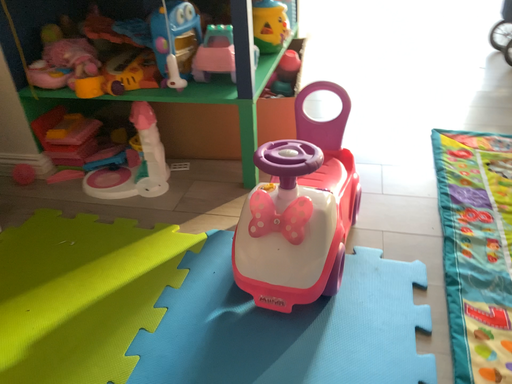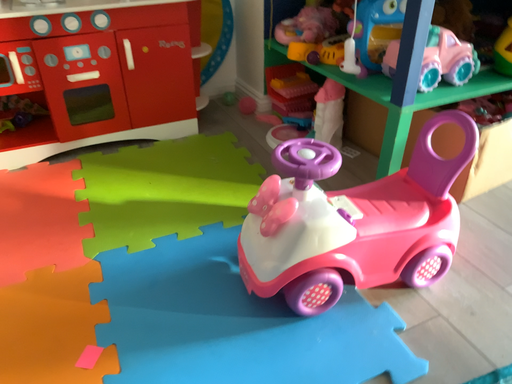
Question: How did the camera likely rotate when shooting the video?

Choices:
 (A) rotated left
 (B) rotated right

Answer: (A)